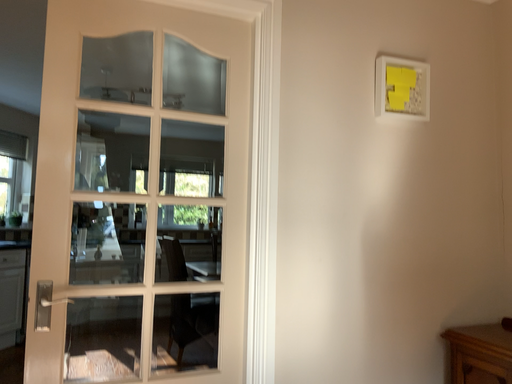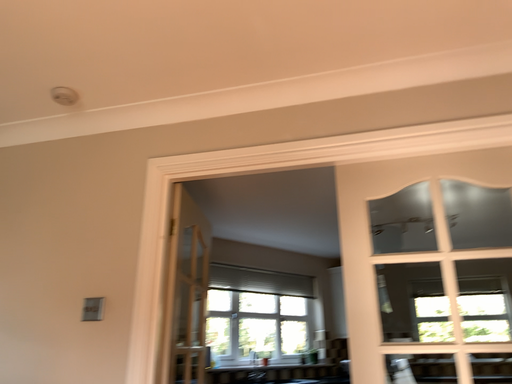
Question: Which way did the camera rotate in the video?

Choices:
 (A) rotated right
 (B) rotated left

Answer: (B)